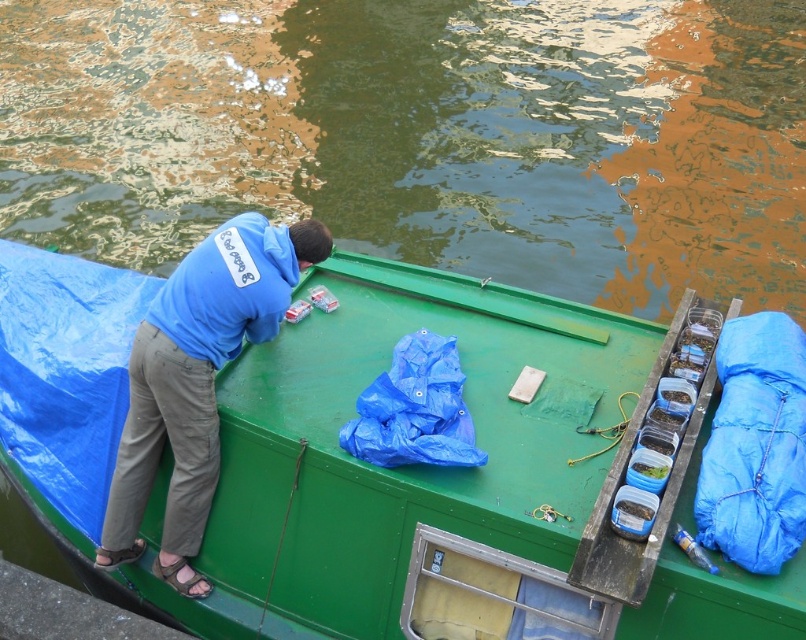
Identify the location of green water at upper center. This screenshot has width=806, height=640. (422, 134).

Measure the distance from green water at upper center to blue cotton hoodie at upper left.

green water at upper center is 7.97 meters from blue cotton hoodie at upper left.

Who is more forward, (653, 173) or (127, 442)?

Point (127, 442) is more forward.

Where is `green water at upper center`? The image size is (806, 640). green water at upper center is located at coordinates (x=422, y=134).

Between point (222, 554) and point (181, 348), which one is positioned behind?

Point (222, 554)

Can you confirm if green matte boat at center is thinner than blue cotton hoodie at upper left?

No, green matte boat at center is not thinner than blue cotton hoodie at upper left.

What do you see at coordinates (445, 481) in the screenshot?
I see `green matte boat at center` at bounding box center [445, 481].

The width and height of the screenshot is (806, 640). Identify the location of green matte boat at center. (445, 481).

Is green water at upper center closer to camera compared to green matte boat at center?

No, green water at upper center is behind green matte boat at center.

Which is behind, point (93, 97) or point (107, 332)?

Point (93, 97)

Who is more distant from viewer, (462, 10) or (368, 545)?

Positioned behind is point (462, 10).

At what (x,y) coordinates should I click in order to perform the action: click on green water at upper center. Please return your answer as a coordinate pair (x, y). The image size is (806, 640). Looking at the image, I should click on (422, 134).